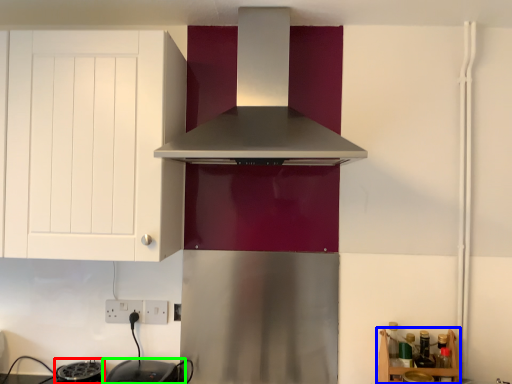
Question: Which object is the closest to the appliance (highlighted by a red box)? Choose among these: shelf (highlighted by a blue box) or appliance (highlighted by a green box).

Choices:
 (A) shelf
 (B) appliance

Answer: (B)